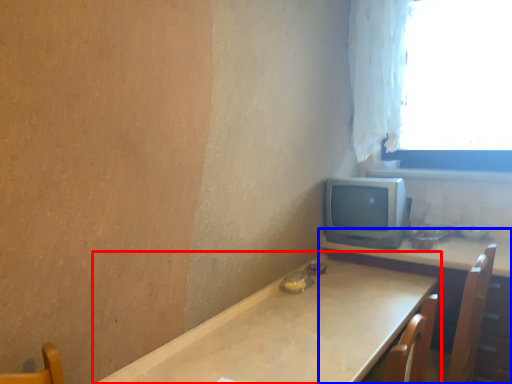
Question: Which object appears closest to the camera in this image, table (highlighted by a red box) or table (highlighted by a blue box)?

Choices:
 (A) table
 (B) table

Answer: (A)